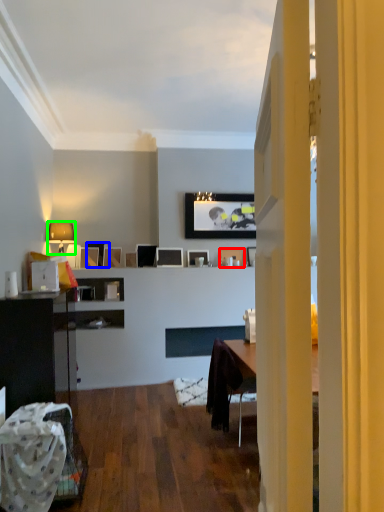
Question: Estimate the real-world distances between objects in this image. Which object is closer to picture frame (highlighted by a red box), picture frame (highlighted by a blue box) or lamp (highlighted by a green box)?

Choices:
 (A) picture frame
 (B) lamp

Answer: (A)